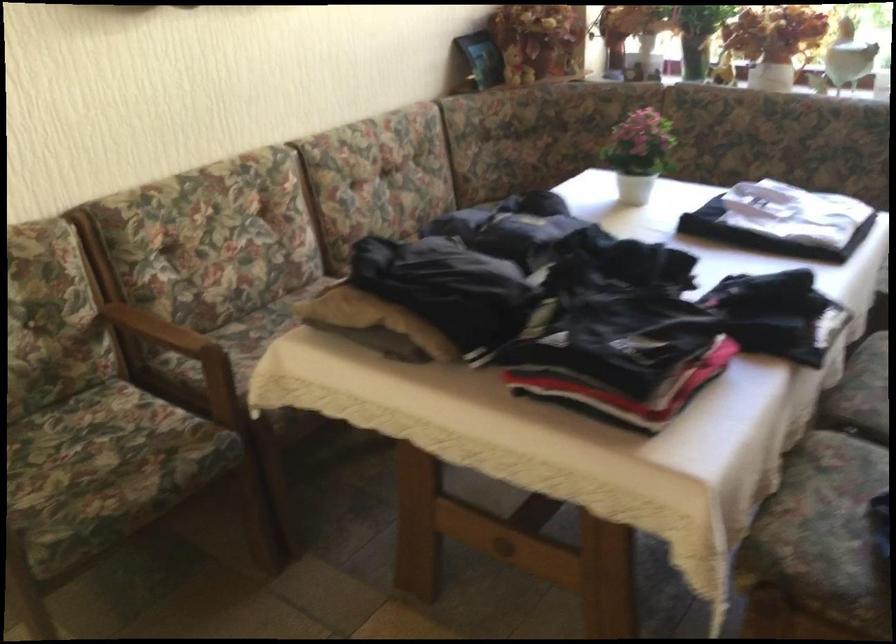
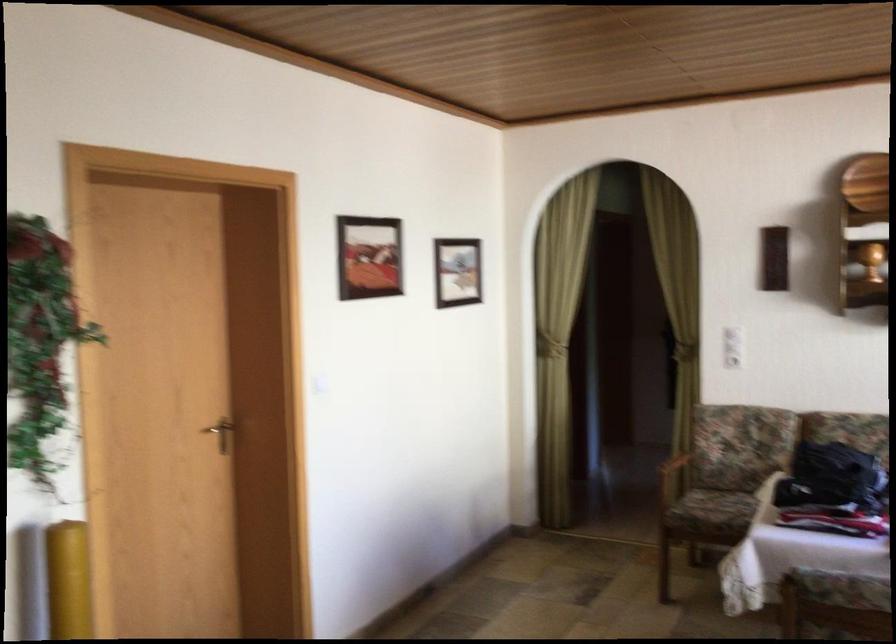
Where in the second image is the point corresponding to the point at 113,468 from the first image?

(725, 507)